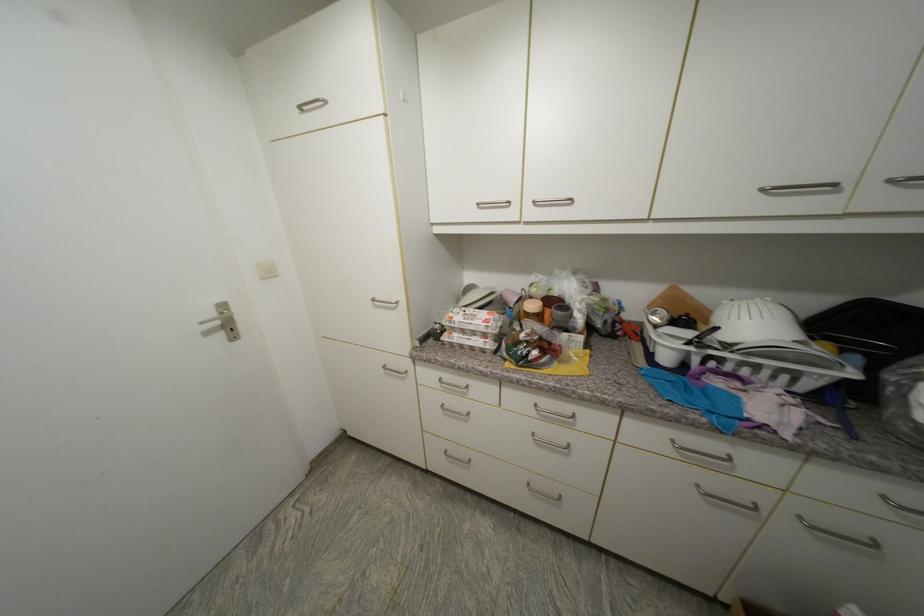
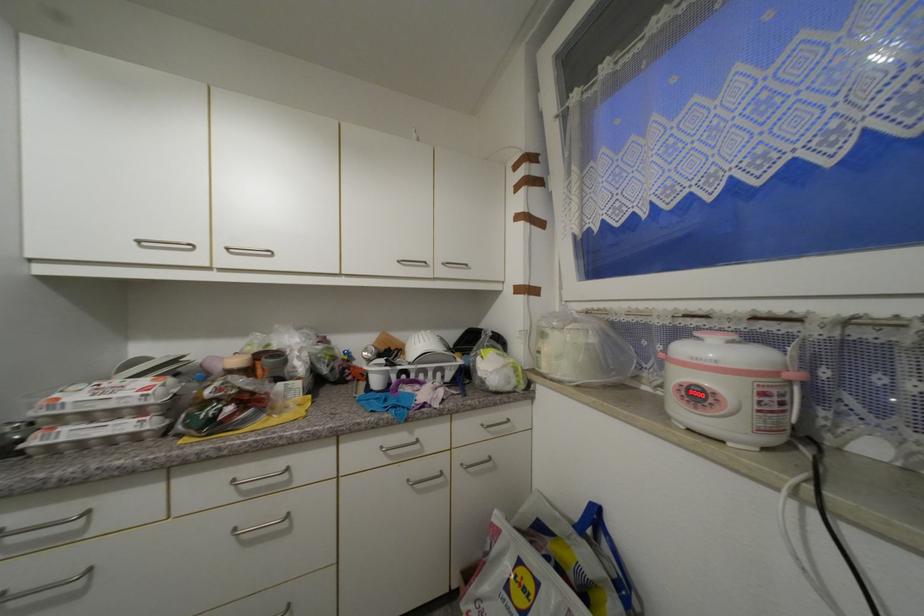
Locate, in the second image, the point that corresponds to pixel 671 359 in the first image.

(382, 384)